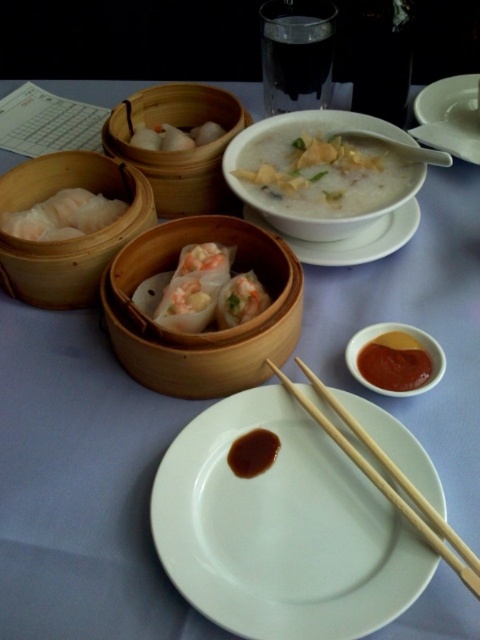
Who is positioned more to the left, matte bamboo steamer at left or shiny pink dumplings at center?

→ From the viewer's perspective, matte bamboo steamer at left appears more on the left side.

Between matte bamboo steamer at left and shiny pink dumplings at center, which one has less height?

Standing shorter between the two is shiny pink dumplings at center.

Between point (68, 176) and point (249, 292), which one is positioned in front?

Point (249, 292)

Identify the location of matte bamboo steamer at left. 69,237.

Between matte bamboo steamer at upper left and white ceramic bowl at upper center, which one is positioned higher?

matte bamboo steamer at upper left is above.

What do you see at coordinates (179, 150) in the screenshot? I see `matte bamboo steamer at upper left` at bounding box center [179, 150].

Identify the location of matte bamboo steamer at upper left. The width and height of the screenshot is (480, 640). click(179, 150).

Is white ceramic plate at center to the right of brown glossy sauce at center from the viewer's perspective?

Yes, white ceramic plate at center is to the right of brown glossy sauce at center.

Who is positioned more to the right, white ceramic plate at center or brown glossy sauce at center?

white ceramic plate at center

Locate an element on the screen. white ceramic plate at center is located at coordinates (282, 529).

Identify the location of white ceramic plate at center. (282, 529).